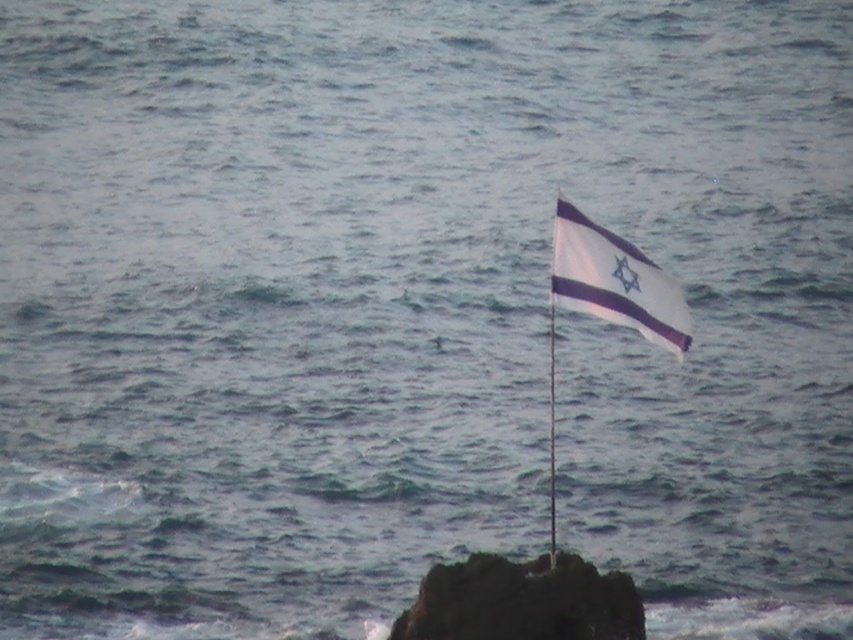
You are a photographer aiming to capture the white fabric flag at upper right and the rough textured rock at center in a single frame. Given that your camera has a fixed focal length and you cannot move closer, which object should you prioritize framing first to ensure both fit in the viewfinder?

The rough textured rock at center is wider than the white fabric flag at upper right. Therefore, you should prioritize framing the rough textured rock at center first to ensure both objects fit within the camera viewfinder.